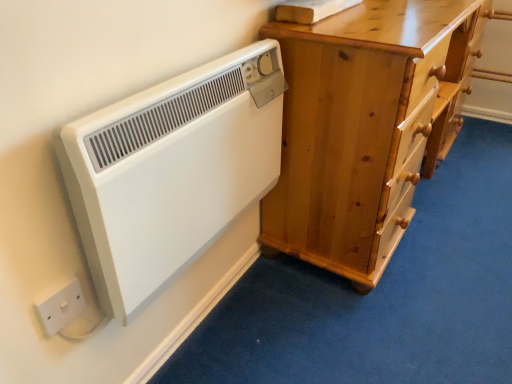
Question: From a real-world perspective, is white plastic electric outlet at lower left positioned over white plastic radiator at left based on gravity?

Choices:
 (A) no
 (B) yes

Answer: (A)

Question: From a real-world perspective, is white plastic electric outlet at lower left below white plastic radiator at left?

Choices:
 (A) yes
 (B) no

Answer: (A)

Question: From the image's perspective, is white plastic electric outlet at lower left located beneath white plastic radiator at left?

Choices:
 (A) yes
 (B) no

Answer: (A)

Question: Is white plastic electric outlet at lower left positioned in front of white plastic radiator at left?

Choices:
 (A) no
 (B) yes

Answer: (A)

Question: Is white plastic electric outlet at lower left completely or partially outside of white plastic radiator at left?

Choices:
 (A) no
 (B) yes

Answer: (B)

Question: Is white plastic electric outlet at lower left inside the boundaries of light brown wooden chest of drawers at right, or outside?

Choices:
 (A) outside
 (B) inside

Answer: (A)

Question: From their relative heights in the image, would you say white plastic electric outlet at lower left is taller or shorter than light brown wooden chest of drawers at right?

Choices:
 (A) short
 (B) tall

Answer: (A)

Question: Considering the positions of point (58, 286) and point (288, 135), is point (58, 286) closer or farther from the camera than point (288, 135)?

Choices:
 (A) farther
 (B) closer

Answer: (B)

Question: Looking at the image, does white plastic electric outlet at lower left seem bigger or smaller compared to light brown wooden chest of drawers at right?

Choices:
 (A) big
 (B) small

Answer: (B)

Question: Is light brown wooden chest of drawers at right in front of or behind white plastic electric outlet at lower left in the image?

Choices:
 (A) behind
 (B) front

Answer: (A)

Question: Is light brown wooden chest of drawers at right spatially inside white plastic electric outlet at lower left, or outside of it?

Choices:
 (A) outside
 (B) inside

Answer: (A)

Question: Considering the positions of light brown wooden chest of drawers at right and white plastic electric outlet at lower left in the image, is light brown wooden chest of drawers at right bigger or smaller than white plastic electric outlet at lower left?

Choices:
 (A) big
 (B) small

Answer: (A)

Question: Visually, is light brown wooden chest of drawers at right positioned to the left or to the right of white plastic electric outlet at lower left?

Choices:
 (A) left
 (B) right

Answer: (B)

Question: In terms of height, does white plastic radiator at left look taller or shorter compared to white plastic electric outlet at lower left?

Choices:
 (A) short
 (B) tall

Answer: (B)

Question: Considering the positions of point (59, 140) and point (49, 329), is point (59, 140) closer or farther from the camera than point (49, 329)?

Choices:
 (A) farther
 (B) closer

Answer: (B)